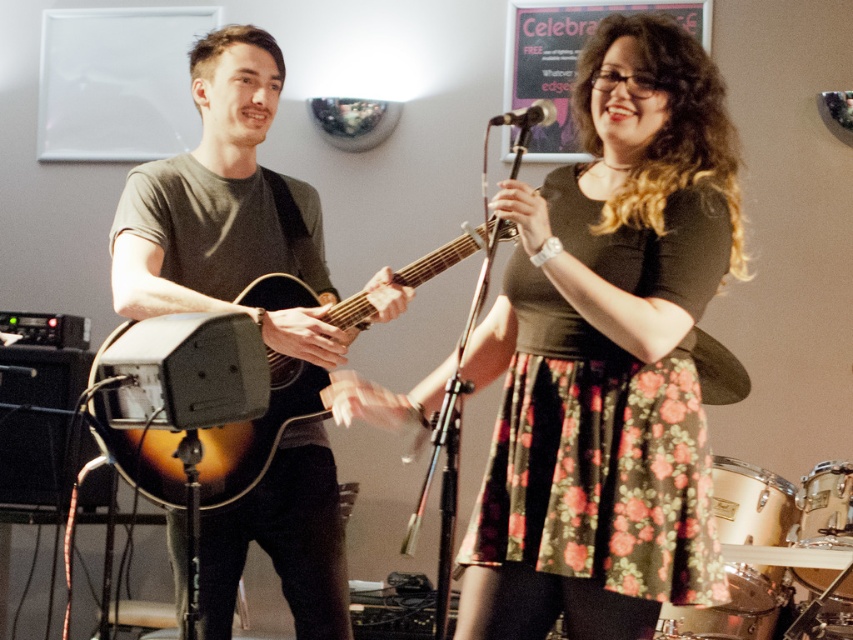
Question: Which point is farther to the camera?

Choices:
 (A) floral skirt at center
 (B) sunburst wood acoustic guitar at center
 (C) matte brown guitar at left
 (D) metallic silver microphone at upper center

Answer: (C)

Question: Is floral skirt at center behind matte brown guitar at left?

Choices:
 (A) no
 (B) yes

Answer: (A)

Question: Is sunburst wood acoustic guitar at center to the left of metallic silver microphone at upper center from the viewer's perspective?

Choices:
 (A) yes
 (B) no

Answer: (A)

Question: Which of the following is the farthest from the observer?

Choices:
 (A) click(x=351, y=301)
 (B) click(x=645, y=449)
 (C) click(x=262, y=493)

Answer: (C)

Question: Among these objects, which one is farthest from the camera?

Choices:
 (A) metallic silver microphone at upper center
 (B) sunburst wood acoustic guitar at center
 (C) matte brown guitar at left

Answer: (C)

Question: Observing the image, what is the correct spatial positioning of matte brown guitar at left in reference to sunburst wood acoustic guitar at center?

Choices:
 (A) right
 (B) left

Answer: (B)